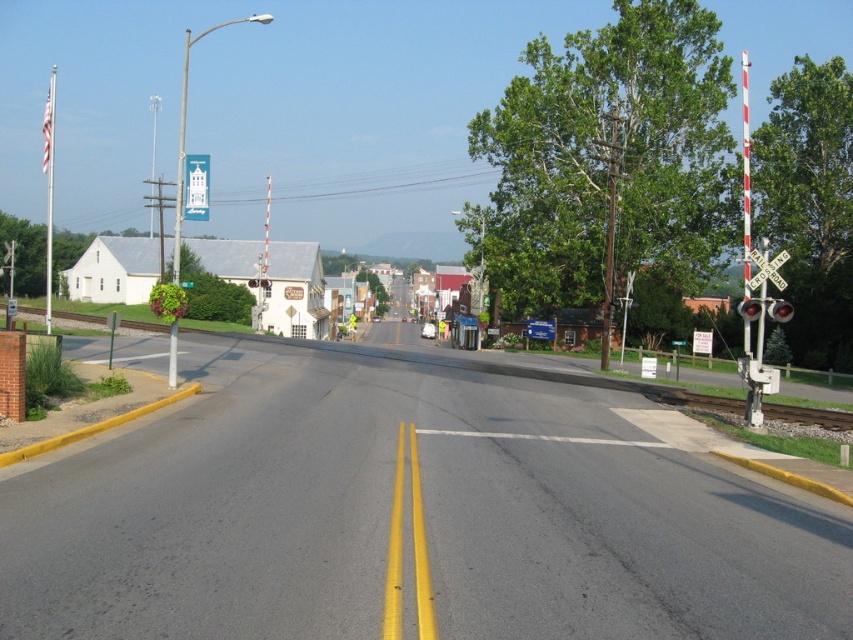
Is white painted building at center bigger than metallic reflective railroad crossing sign at right?

Indeed, white painted building at center has a larger size compared to metallic reflective railroad crossing sign at right.

In the scene shown: Who is more distant from viewer, (251, 276) or (775, 262)?

The point (251, 276) is behind.

Does point (285, 280) come farther from viewer compared to point (780, 264)?

Yes, point (285, 280) is behind point (780, 264).

Find the location of a particular element. The image size is (853, 640). white painted building at center is located at coordinates (115, 269).